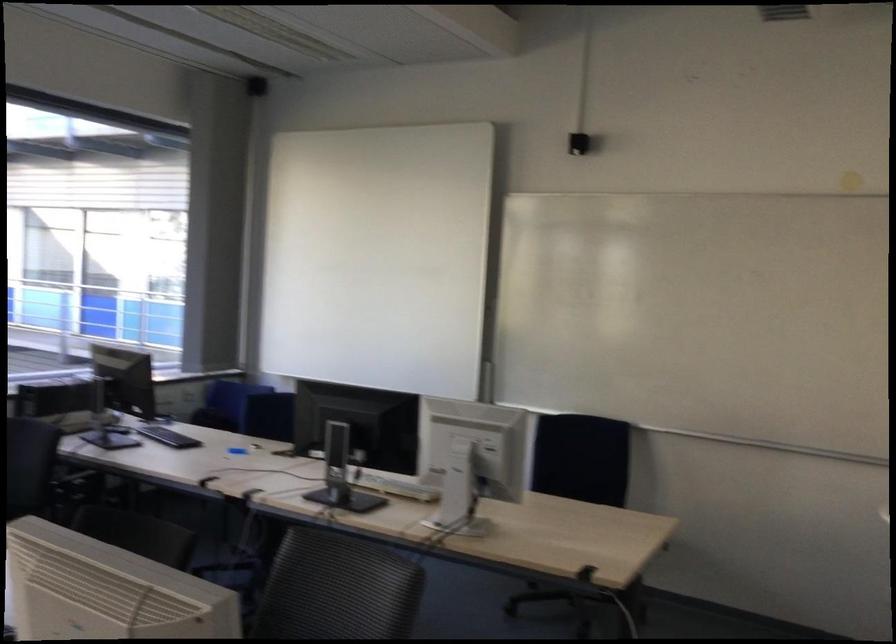
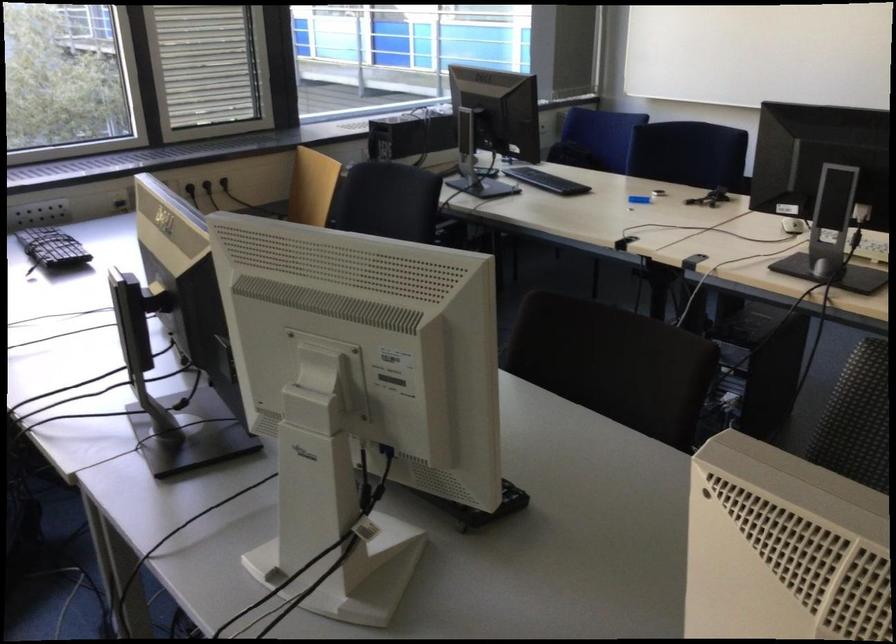
First-person continuous shooting, in which direction is the camera rotating?

The camera rotated toward left-down.